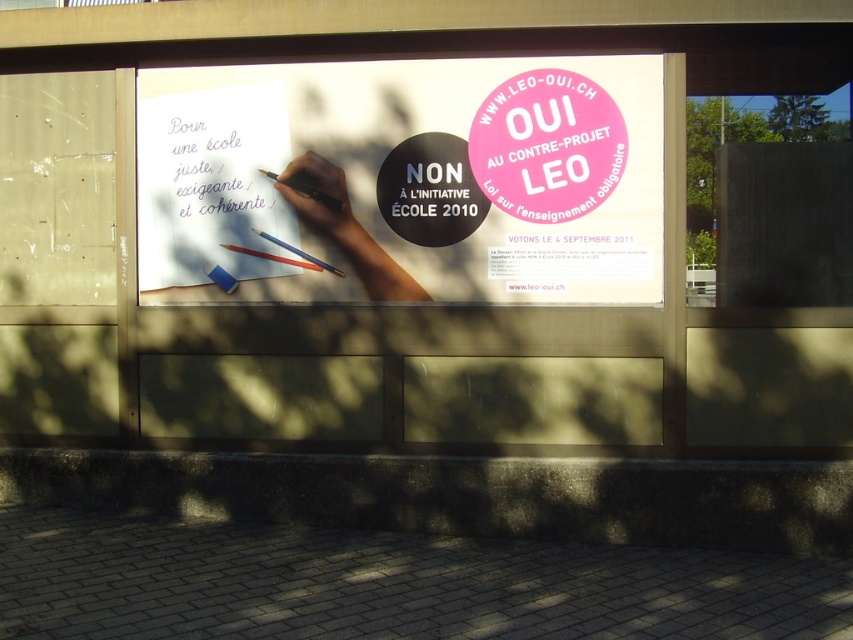
Can you confirm if white paper at upper left is positioned above matte red pen at center?

Indeed, white paper at upper left is positioned over matte red pen at center.

Is white paper at upper left wider than matte red pen at center?

Indeed, white paper at upper left has a greater width compared to matte red pen at center.

Which is in front, point (262, 216) or point (305, 264)?

Point (305, 264)

Where is `white paper at upper left`? white paper at upper left is located at coordinates (218, 160).

Who is more distant from viewer, [521,260] or [297,184]?

Point [297,184]

Between white paper at center and black plastic pen at upper left, which one is positioned lower?

black plastic pen at upper left

Where is `white paper at center`? This screenshot has width=853, height=640. white paper at center is located at coordinates (405, 180).

Is point (311, 156) positioned behind point (289, 244)?

No, it is not.

Which is behind, point (358, 227) or point (289, 248)?

The point (289, 248) is behind.

Does point (361, 234) lie behind point (341, 276)?

No, it is in front of (341, 276).

The width and height of the screenshot is (853, 640). Identify the location of smooth skin hand at center. (343, 227).